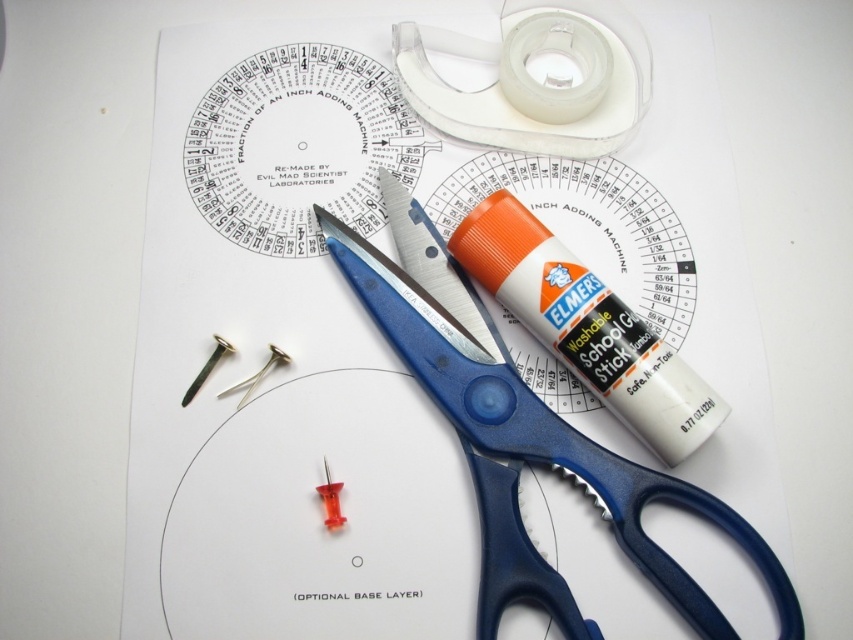
Is transparent plastic tape at upper right taller than silver metallic nails at center?

Yes.

Between transparent plastic tape at upper right and silver metallic nails at center, which one appears on the left side from the viewer's perspective?

Positioned to the left is silver metallic nails at center.

Where is `transparent plastic tape at upper right`? This screenshot has height=640, width=853. transparent plastic tape at upper right is located at coordinates 554,67.

Who is more forward, [444,330] or [521,58]?

Point [444,330]

Who is higher up, blue plastic scissors at upper center or transparent plastic tape at upper right?

transparent plastic tape at upper right

The width and height of the screenshot is (853, 640). What do you see at coordinates (523, 433) in the screenshot?
I see `blue plastic scissors at upper center` at bounding box center [523, 433].

Where is `blue plastic scissors at upper center`? The width and height of the screenshot is (853, 640). blue plastic scissors at upper center is located at coordinates (523, 433).

Consider the image. Measure the distance from blue plastic scissors at upper center to silver metallic nails at center.

blue plastic scissors at upper center is 15.67 inches away from silver metallic nails at center.

Is point (492, 538) closer to viewer compared to point (271, 344)?

Yes, it is in front of point (271, 344).

Is point (683, 500) positioned before point (242, 380)?

Yes, point (683, 500) is in front of point (242, 380).

Where is `blue plastic scissors at upper center`? This screenshot has width=853, height=640. blue plastic scissors at upper center is located at coordinates (523, 433).